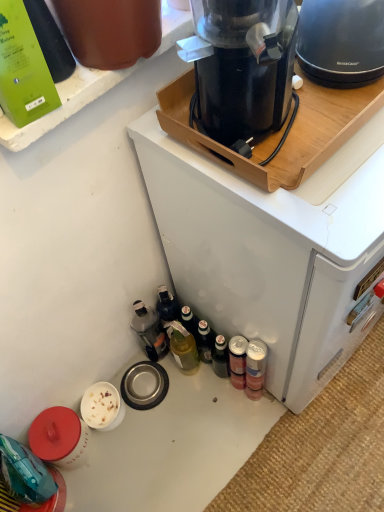
In order to click on free location in front of metallic silver can at lower right, the 2th bottle viewed from the back in this screenshot , I will do `click(266, 450)`.